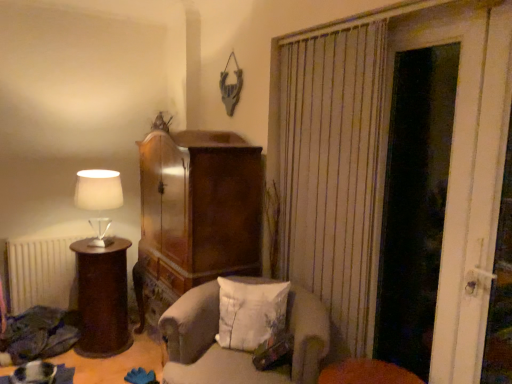
Question: Considering the relative positions of wooden side table at left and matte white lampshade at left in the image provided, is wooden side table at left to the right of matte white lampshade at left from the viewer's perspective?

Choices:
 (A) yes
 (B) no

Answer: (B)

Question: Is wooden side table at left turned away from matte white lampshade at left?

Choices:
 (A) no
 (B) yes

Answer: (A)

Question: Is wooden side table at left not close to matte white lampshade at left?

Choices:
 (A) yes
 (B) no

Answer: (B)

Question: Considering the relative sizes of wooden side table at left and matte white lampshade at left in the image provided, is wooden side table at left thinner than matte white lampshade at left?

Choices:
 (A) yes
 (B) no

Answer: (B)

Question: Could you tell me if wooden side table at left is turned towards matte white lampshade at left?

Choices:
 (A) yes
 (B) no

Answer: (B)

Question: Based on their positions, is matte white lampshade at left located to the left or right of white matte radiator at lower left?

Choices:
 (A) left
 (B) right

Answer: (B)

Question: Looking at the image, does matte white lampshade at left seem bigger or smaller compared to white matte radiator at lower left?

Choices:
 (A) small
 (B) big

Answer: (A)

Question: From a real-world perspective, is matte white lampshade at left positioned above or below white matte radiator at lower left?

Choices:
 (A) above
 (B) below

Answer: (A)

Question: Looking at their shapes, would you say matte white lampshade at left is wider or thinner than white matte radiator at lower left?

Choices:
 (A) wide
 (B) thin

Answer: (A)

Question: In terms of size, does light gray fabric chair at center appear bigger or smaller than wooden side table at left?

Choices:
 (A) big
 (B) small

Answer: (A)

Question: Choose the correct answer: Is light gray fabric chair at center inside wooden side table at left or outside it?

Choices:
 (A) outside
 (B) inside

Answer: (A)

Question: From their relative heights in the image, would you say light gray fabric chair at center is taller or shorter than wooden side table at left?

Choices:
 (A) tall
 (B) short

Answer: (A)

Question: From a real-world perspective, is light gray fabric chair at center above or below wooden side table at left?

Choices:
 (A) above
 (B) below

Answer: (B)

Question: From a real-world perspective, relative to light gray fabric chair at center, is white wooden door at right vertically above or below?

Choices:
 (A) below
 (B) above

Answer: (B)

Question: In the image, is white wooden door at right positioned in front of or behind light gray fabric chair at center?

Choices:
 (A) behind
 (B) front

Answer: (B)